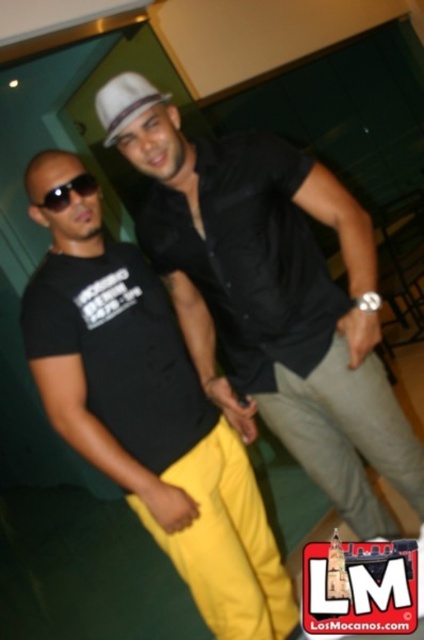
Question: Can you confirm if matte black shirt at center is positioned below black matte t-shirt at center?

Choices:
 (A) no
 (B) yes

Answer: (A)

Question: Which point is closer to the camera?

Choices:
 (A) (122, 147)
 (B) (155, 456)
 (C) (156, 99)
 (D) (49, 202)

Answer: (C)

Question: Is matte black shirt at center to the right of black matte sunglasses at left from the viewer's perspective?

Choices:
 (A) yes
 (B) no

Answer: (A)

Question: Which of the following is the closest to the observer?

Choices:
 (A) (64, 204)
 (B) (167, 497)

Answer: (A)

Question: Is the position of black matte t-shirt at center less distant than that of black matte sunglasses at left?

Choices:
 (A) yes
 (B) no

Answer: (A)

Question: Which of these objects is positioned farthest from the black matte t-shirt at center?

Choices:
 (A) matte black shirt at center
 (B) white felt fedora at center
 (C) black matte sunglasses at left

Answer: (B)